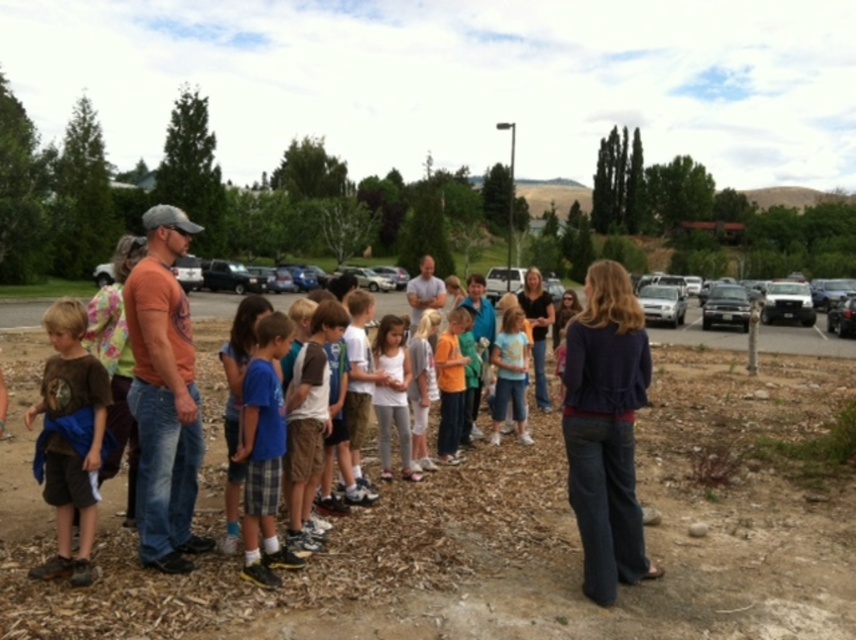
Question: Which object is closer to the camera taking this photo?

Choices:
 (A) silver metallic sedan at right
 (B) metallic silver car at right
 (C) blue plaid shorts at center

Answer: (C)

Question: Which object appears closest to the camera in this image?

Choices:
 (A) metallic silver car at right
 (B) orange t-shirt at center
 (C) blue plaid shorts at center

Answer: (C)

Question: Is silver metallic sedan at right to the left of silver metallic sedan at center from the viewer's perspective?

Choices:
 (A) yes
 (B) no

Answer: (B)

Question: Which point appears closest to the camera in this image?

Choices:
 (A) (728, 300)
 (B) (646, 308)
 (C) (664, 314)
 (D) (45, 369)

Answer: (D)

Question: Does brown cotton shirt at lower left appear under metallic silver car at right?

Choices:
 (A) no
 (B) yes

Answer: (B)

Question: Is blue plaid shorts at center smaller than silver metallic sedan at right?

Choices:
 (A) yes
 (B) no

Answer: (A)